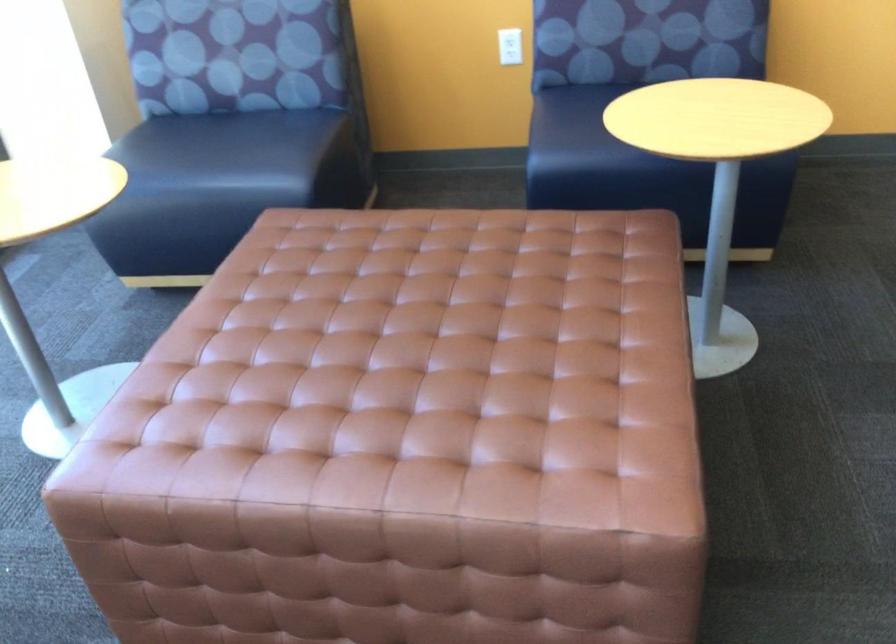
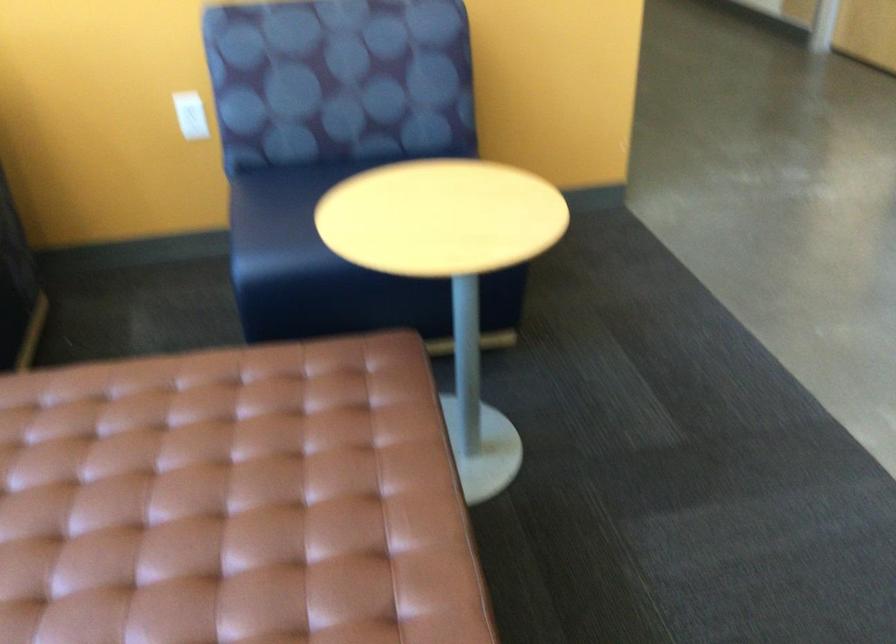
The point at (495,312) is marked in the first image. Where is the corresponding point in the second image?

(231, 502)